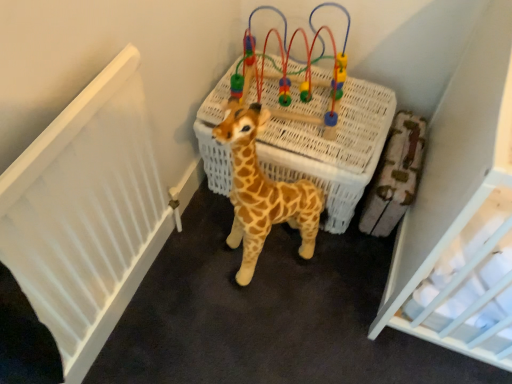
Where is `blank space situated above white wicker basket at center (from a real-world perspective)`? This screenshot has height=384, width=512. blank space situated above white wicker basket at center (from a real-world perspective) is located at coordinates (315, 109).